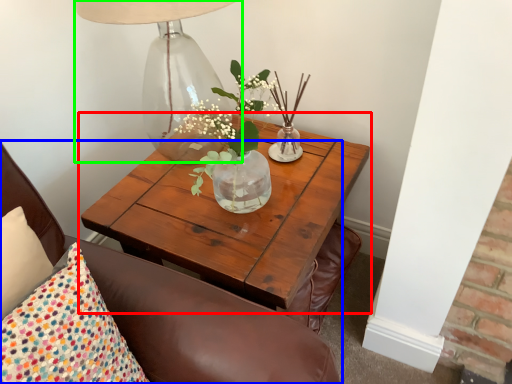
Question: Which object is the closest to the coffee table (highlighted by a red box)? Choose among these: chair (highlighted by a blue box) or table lamp (highlighted by a green box).

Choices:
 (A) chair
 (B) table lamp

Answer: (A)